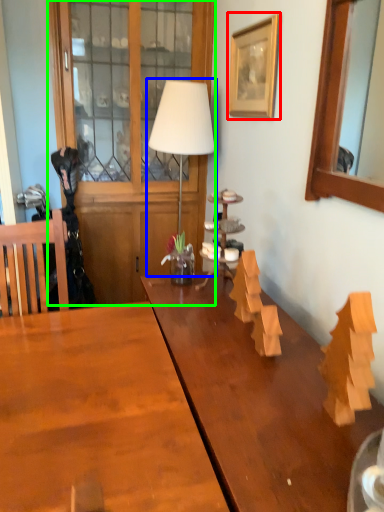
Question: Based on their relative distances, which object is farther from picture frame (highlighted by a red box)? Choose from table lamp (highlighted by a blue box) and dresser (highlighted by a green box).

Choices:
 (A) table lamp
 (B) dresser

Answer: (B)